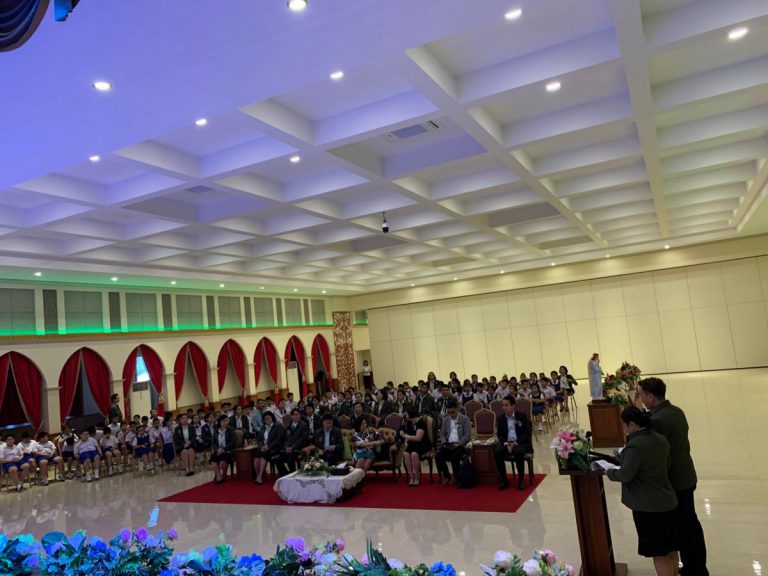
This screenshot has height=576, width=768. I want to click on green lights, so click(x=217, y=328), click(x=190, y=333), click(x=151, y=335).